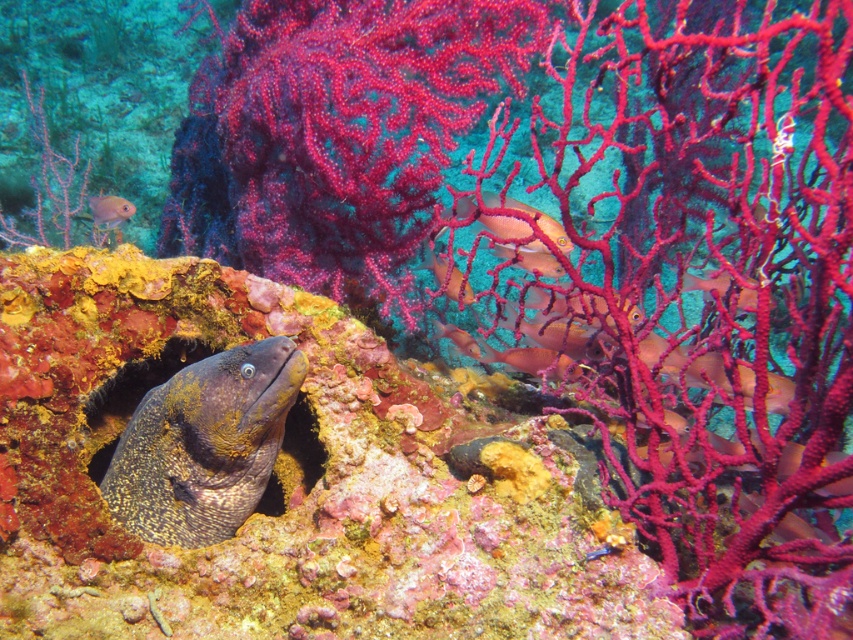
Question: Which object is closer to the camera taking this photo?

Choices:
 (A) shiny orange fish at center
 (B) orange matte fish at upper right

Answer: (B)

Question: Can you confirm if speckled yellow-green moray eel at center is thinner than shiny orange fish at center?

Choices:
 (A) no
 (B) yes

Answer: (A)

Question: Which of these objects is positioned closest to the smooth pinkish-orange fish at center?

Choices:
 (A) translucent pink coral at center
 (B) orange matte fish at upper right
 (C) orange matte fish at upper left

Answer: (A)

Question: Is vivid pink coral at center thinner than translucent pink coral at center?

Choices:
 (A) yes
 (B) no

Answer: (B)

Question: Does speckled yellow-green moray eel at center appear over orange matte fish at upper left?

Choices:
 (A) no
 (B) yes

Answer: (A)

Question: Estimate the real-world distances between objects in this image. Which object is closer to the shiny orange fish at center?

Choices:
 (A) orange matte fish at upper right
 (B) vivid pink coral at center
 (C) translucent pink coral at center

Answer: (C)